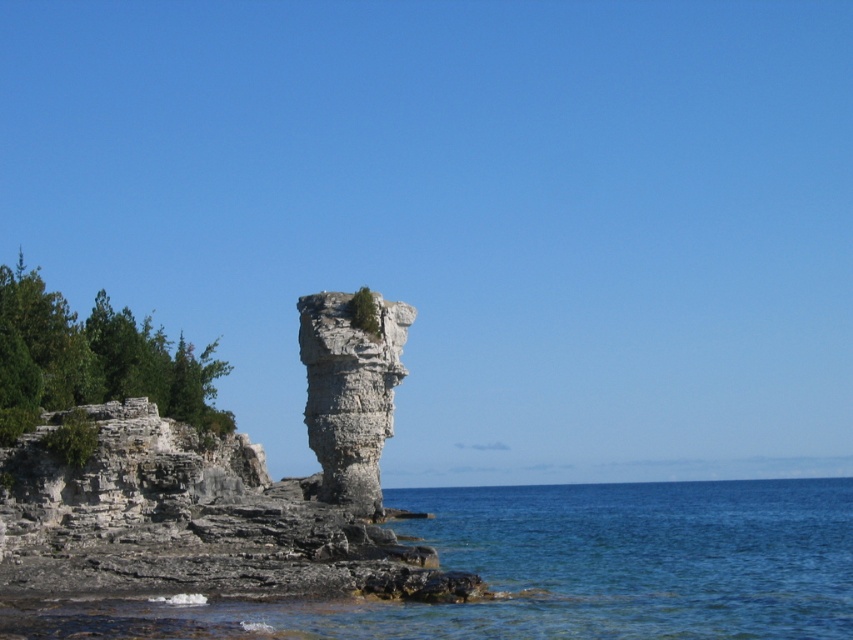
Question: Among these points, which one is nearest to the camera?

Choices:
 (A) (10, 381)
 (B) (469, 634)
 (C) (308, 426)

Answer: (B)

Question: Based on their relative distances, which object is farther from the clear blue water at lower center?

Choices:
 (A) gray stone column at center
 (B) green leafy tree at left

Answer: (B)

Question: Can you confirm if clear blue water at lower center is positioned to the left of green leafy tree at left?

Choices:
 (A) yes
 (B) no

Answer: (B)

Question: Where is clear blue water at lower center located in relation to green leafy tree at left in the image?

Choices:
 (A) above
 (B) below

Answer: (B)

Question: Which object appears farthest from the camera in this image?

Choices:
 (A) green leafy tree at left
 (B) gray stone column at center

Answer: (B)

Question: Observing the image, what is the correct spatial positioning of clear blue water at lower center in reference to gray stone column at center?

Choices:
 (A) right
 (B) left

Answer: (A)